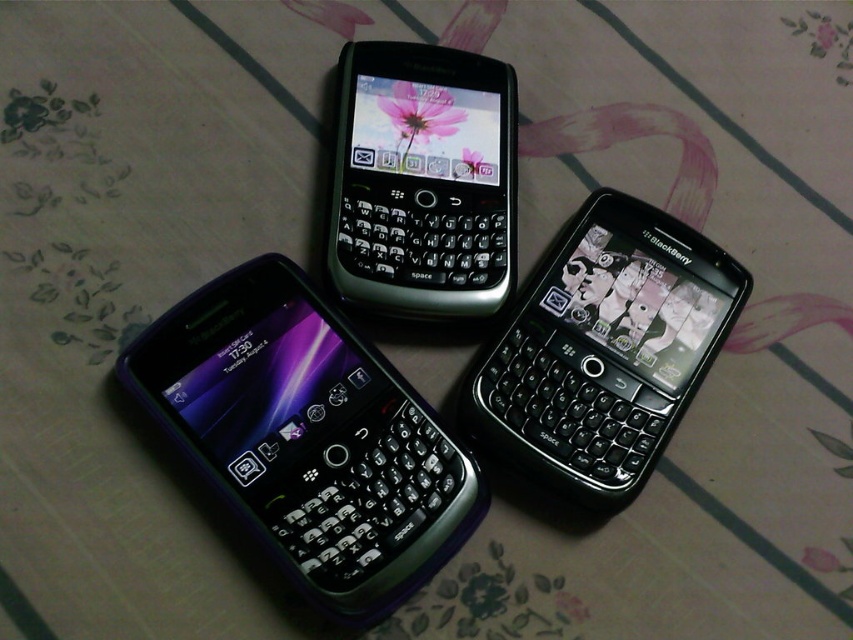
Question: Does black glossy phone at center right appear on the right side of sleek black keyboard phone at center?

Choices:
 (A) no
 (B) yes

Answer: (B)

Question: Which is farther from the purple rubberized phone at center-left?

Choices:
 (A) black glossy phone at center right
 (B) sleek black keyboard phone at center

Answer: (A)

Question: Is black glossy phone at center right behind sleek black keyboard phone at center?

Choices:
 (A) yes
 (B) no

Answer: (B)

Question: Which point is closer to the camera?

Choices:
 (A) purple rubberized phone at center-left
 (B) black glossy phone at center right
 (C) sleek black keyboard phone at center

Answer: (A)

Question: Is black glossy phone at center right bigger than sleek black keyboard phone at center?

Choices:
 (A) yes
 (B) no

Answer: (A)

Question: Which object appears closest to the camera in this image?

Choices:
 (A) black glossy phone at center right
 (B) purple rubberized phone at center-left
 (C) sleek black keyboard phone at center

Answer: (B)